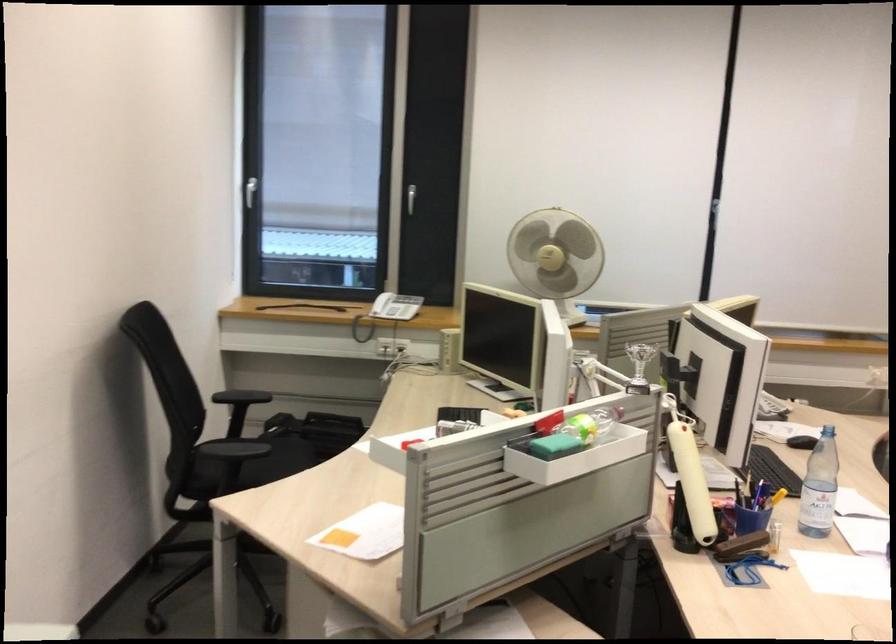
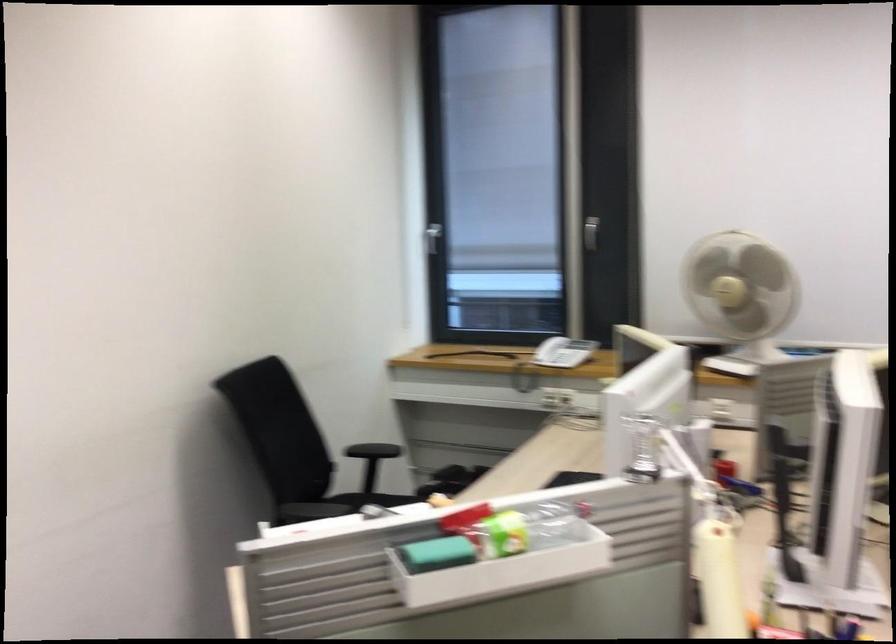
In the second image, find the point that corresponds to (x=397, y=308) in the first image.

(563, 352)